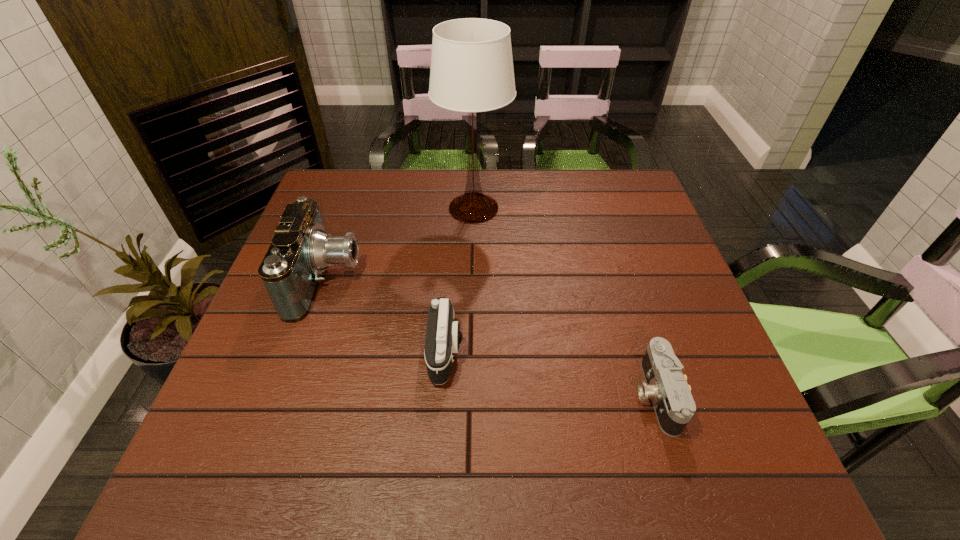
In the image, there is a desktop. Where is `vacant space at the right edge`? This screenshot has height=540, width=960. vacant space at the right edge is located at coordinates (670, 312).

The image size is (960, 540). Identify the location of vacant space at the far left corner of the desktop. 332,204.

Find the location of a particular element. This screenshot has width=960, height=540. free region at the far right corner is located at coordinates (623, 200).

Find the location of a particular element. free space that is in between the table lamp and the second shortest object is located at coordinates (460, 280).

At what (x,y) coordinates should I click in order to perform the action: click on unoccupied area between the shorter camera and the taller camera. Please return your answer as a coordinate pair (x, y). This screenshot has height=540, width=960. Looking at the image, I should click on (551, 373).

This screenshot has width=960, height=540. I want to click on vacant region between the second tallest object and the right camera, so click(492, 337).

Locate an element on the screen. The height and width of the screenshot is (540, 960). free area in between the second tallest object and the right camera is located at coordinates (492, 337).

The image size is (960, 540). I want to click on free spot between the shortest object and the table lamp, so click(x=564, y=301).

Find the location of a particular element. This screenshot has width=960, height=540. free space between the shorter camera and the table lamp is located at coordinates (564, 301).

Locate an element on the screen. The width and height of the screenshot is (960, 540). vacant region between the rightmost object and the farthest object is located at coordinates (564, 301).